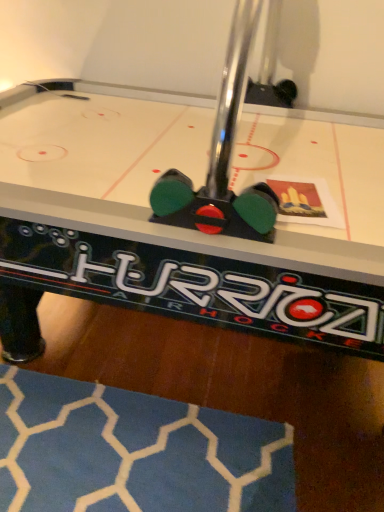
At what (x,y) coordinates should I click in order to perform the action: click on vacant space underneath blue fabric rug at lower left (from a real-world perspective). Please return your answer as a coordinate pair (x, y). The height and width of the screenshot is (512, 384). Looking at the image, I should click on (x=109, y=481).